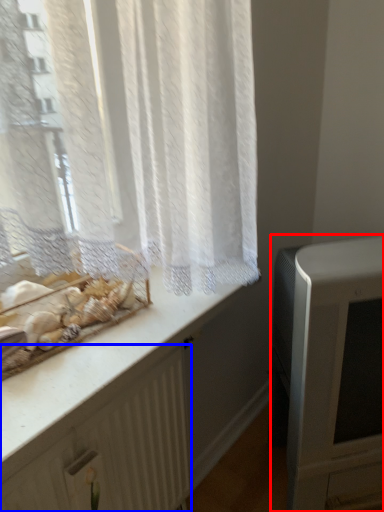
Question: Which object appears farthest to the camera in this image, appliance (highlighted by a red box) or radiator (highlighted by a blue box)?

Choices:
 (A) appliance
 (B) radiator

Answer: (A)